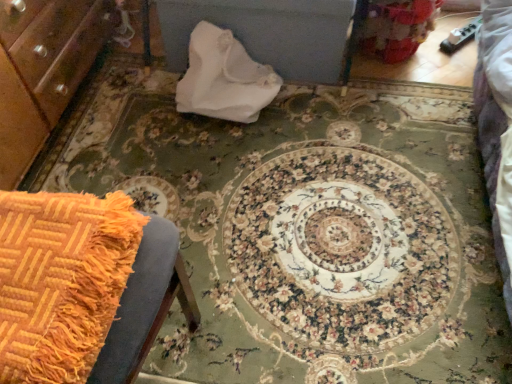
Find the location of a particular element. The width and height of the screenshot is (512, 384). white paper bag at center is located at coordinates (224, 78).

What is the approximate height of white paper bag at center?

It is 10.15 inches.

The image size is (512, 384). What do you see at coordinates (224, 78) in the screenshot?
I see `white paper bag at center` at bounding box center [224, 78].

Measure the distance between point (x=95, y=263) and camera.

Point (x=95, y=263) is 28.90 inches away from camera.

Where is `orange woven blanket at lower left`? The height and width of the screenshot is (384, 512). orange woven blanket at lower left is located at coordinates (83, 287).

What do you see at coordinates (83, 287) in the screenshot? The width and height of the screenshot is (512, 384). I see `orange woven blanket at lower left` at bounding box center [83, 287].

What is the approximate width of orange woven blanket at lower left?

13.94 inches.

Where is `white paper bag at center`? This screenshot has height=384, width=512. white paper bag at center is located at coordinates (224, 78).

Based on the photo, can you confirm if orange woven blanket at lower left is positioned to the left of white paper bag at center?

Yes.

Is orange woven blanket at lower left closer to camera compared to white paper bag at center?

Yes, orange woven blanket at lower left is closer to the viewer.

Which is in front, point (167, 297) or point (255, 67)?

The point (167, 297) is closer.

From the image's perspective, is orange woven blanket at lower left positioned above or below white paper bag at center?

Clearly, from the image's perspective, orange woven blanket at lower left is below white paper bag at center.

From a real-world perspective, is orange woven blanket at lower left under white paper bag at center?

No, from a real-world perspective, orange woven blanket at lower left is not under white paper bag at center.

Which object is wider, orange woven blanket at lower left or white paper bag at center?

With larger width is orange woven blanket at lower left.

Considering the sizes of objects orange woven blanket at lower left and white paper bag at center in the image provided, who is shorter, orange woven blanket at lower left or white paper bag at center?

orange woven blanket at lower left.

Is orange woven blanket at lower left smaller than white paper bag at center?

Indeed, orange woven blanket at lower left has a smaller size compared to white paper bag at center.

Is orange woven blanket at lower left inside the boundaries of white paper bag at center, or outside?

orange woven blanket at lower left exists outside the volume of white paper bag at center.

Would you say orange woven blanket at lower left is a long distance from white paper bag at center?

No, there isn't a large distance between orange woven blanket at lower left and white paper bag at center.

Is orange woven blanket at lower left positioned with its back to white paper bag at center?

orange woven blanket at lower left is not turned away from white paper bag at center.

How different are the orientations of orange woven blanket at lower left and white paper bag at center in degrees?

The angle between the facing direction of orange woven blanket at lower left and the facing direction of white paper bag at center is 180 degrees.

How far apart are orange woven blanket at lower left and white paper bag at center?

They are 37.06 inches apart.

What are the coordinates of `furniture lying in front of the white paper bag at center` in the screenshot? It's located at (83, 287).

From the picture: Can you confirm if white paper bag at center is positioned to the left of orange woven blanket at lower left?

In fact, white paper bag at center is to the right of orange woven blanket at lower left.

Considering their positions, is white paper bag at center located in front of or behind orange woven blanket at lower left?

Clearly, white paper bag at center is behind orange woven blanket at lower left.

In the scene shown: Which is closer, (243,63) or (54,195)?

Point (243,63) is farther from the camera than point (54,195).

From the image's perspective, is white paper bag at center positioned above or below orange woven blanket at lower left?

white paper bag at center is above orange woven blanket at lower left.

From a real-world perspective, is white paper bag at center positioned above or below orange woven blanket at lower left?

Clearly, from a real-world perspective, white paper bag at center is below orange woven blanket at lower left.

Consider the image. Which of these two, white paper bag at center or orange woven blanket at lower left, is thinner?

white paper bag at center.

Which of these two, white paper bag at center or orange woven blanket at lower left, stands taller?

white paper bag at center.

Can you confirm if white paper bag at center is smaller than orange woven blanket at lower left?

Actually, white paper bag at center might be larger than orange woven blanket at lower left.

Is white paper bag at center surrounding orange woven blanket at lower left?

No.

Is white paper bag at center in contact with orange woven blanket at lower left?

No, white paper bag at center is not with orange woven blanket at lower left.

Is white paper bag at center oriented towards orange woven blanket at lower left?

Yes, white paper bag at center is turned towards orange woven blanket at lower left.

What's the angular difference between white paper bag at center and orange woven blanket at lower left's facing directions?

180 degrees.

Image resolution: width=512 pixels, height=384 pixels. I want to click on material lying above the orange woven blanket at lower left (from the image's perspective), so click(x=224, y=78).

The height and width of the screenshot is (384, 512). I want to click on material below the orange woven blanket at lower left (from a real-world perspective), so click(224, 78).

Where is `material above the orange woven blanket at lower left (from the image's perspective)`? This screenshot has width=512, height=384. material above the orange woven blanket at lower left (from the image's perspective) is located at coordinates (224, 78).